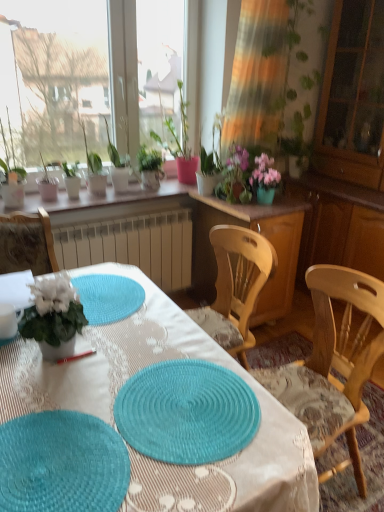
Question: Which direction should I rotate to look at matte white pot at center, which is the 1th houseplant from right to left, — up or down?

Choices:
 (A) down
 (B) up

Answer: (B)

Question: Can we say matte white pot at upper left, the 5th houseplant positioned from the right, lies outside wooden cabinet at center?

Choices:
 (A) yes
 (B) no

Answer: (A)

Question: Considering the relative sizes of matte white pot at upper left, positioned as the 2th houseplant in left-to-right order, and wooden cabinet at center in the image provided, is matte white pot at upper left, positioned as the 2th houseplant in left-to-right order, shorter than wooden cabinet at center?

Choices:
 (A) yes
 (B) no

Answer: (A)

Question: Is matte white pot at upper left, positioned as the 2th houseplant in left-to-right order, at the left side of wooden cabinet at center?

Choices:
 (A) yes
 (B) no

Answer: (A)

Question: Is matte white pot at upper left, the 5th houseplant positioned from the right, aimed at wooden cabinet at center?

Choices:
 (A) yes
 (B) no

Answer: (B)

Question: Could wooden cabinet at center be considered to be inside matte white pot at upper left, the 5th houseplant positioned from the right?

Choices:
 (A) no
 (B) yes

Answer: (A)

Question: Is matte white pot at upper left, positioned as the 2th houseplant in left-to-right order, positioned behind wooden cabinet at center?

Choices:
 (A) no
 (B) yes

Answer: (B)

Question: Is teal woven mat at lower left, positioned as the 2th mat in right-to-left order, closer to the viewer compared to transparent glass cabinet at right?

Choices:
 (A) no
 (B) yes

Answer: (B)

Question: Can you confirm if teal woven mat at lower left, which is the 1th mat in left-to-right order, is positioned to the right of transparent glass cabinet at right?

Choices:
 (A) yes
 (B) no

Answer: (B)

Question: From the image's perspective, is teal woven mat at lower left, positioned as the 2th mat in right-to-left order, located above transparent glass cabinet at right?

Choices:
 (A) yes
 (B) no

Answer: (B)

Question: From a real-world perspective, does teal woven mat at lower left, which is the 1th mat in left-to-right order, stand above transparent glass cabinet at right?

Choices:
 (A) yes
 (B) no

Answer: (B)

Question: Is teal woven mat at lower left, positioned as the 2th mat in right-to-left order, facing towards transparent glass cabinet at right?

Choices:
 (A) no
 (B) yes

Answer: (A)

Question: Is teal woven mat at lower left, positioned as the 2th mat in right-to-left order, positioned far away from transparent glass cabinet at right?

Choices:
 (A) yes
 (B) no

Answer: (A)

Question: Can you confirm if transparent glass cabinet at right is positioned to the right of wooden cabinet at center?

Choices:
 (A) yes
 (B) no

Answer: (A)